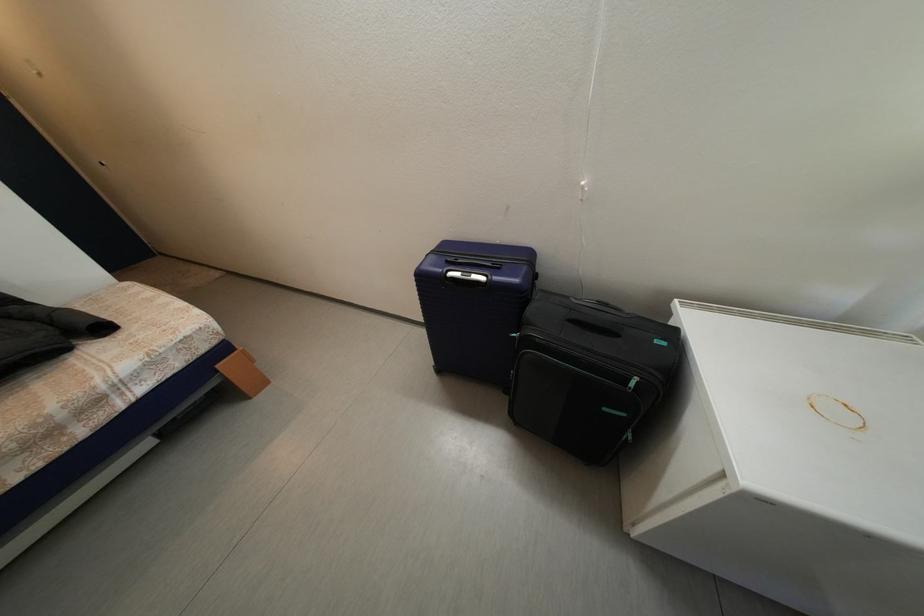
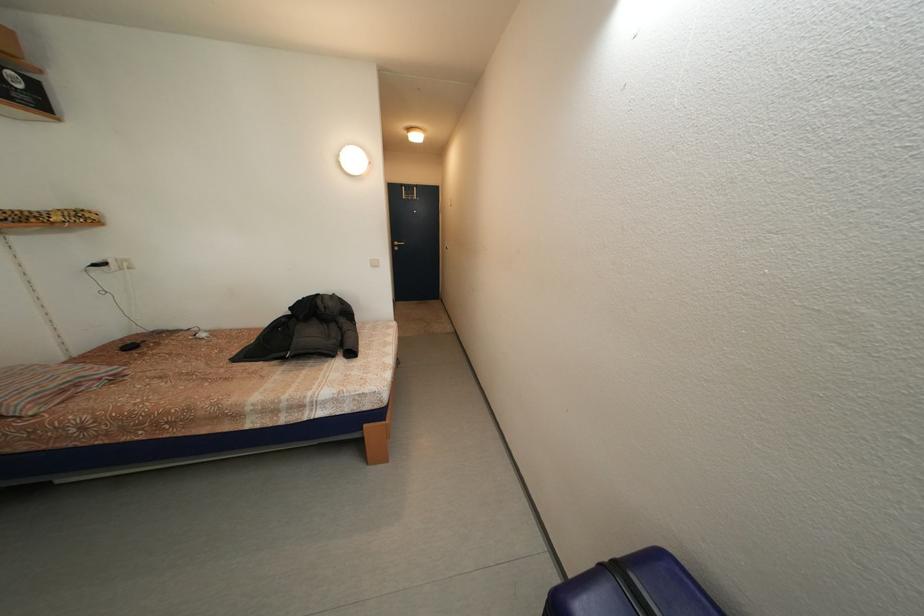
Question: The images are taken continuously from a first-person perspective. In which direction is your viewpoint rotating?

Choices:
 (A) Left
 (B) Right
 (C) Up
 (D) Down

Answer: (A)